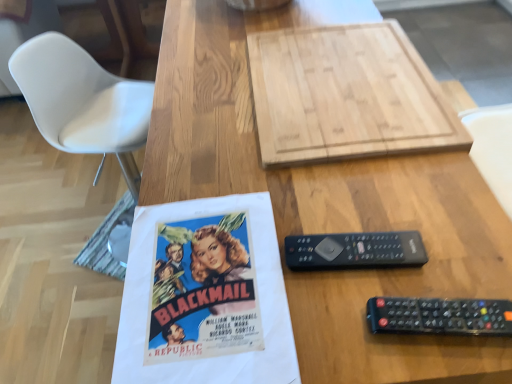
The width and height of the screenshot is (512, 384). I want to click on free space that is in between black plastic remote at lower right and black plastic remote at right, so click(381, 297).